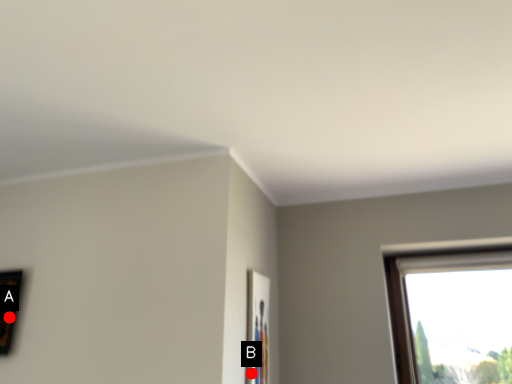
Question: Two points are circled on the image, labeled by A and B beside each circle. Among these points, which one is nearest to the camera?

Choices:
 (A) A is closer
 (B) B is closer

Answer: (B)